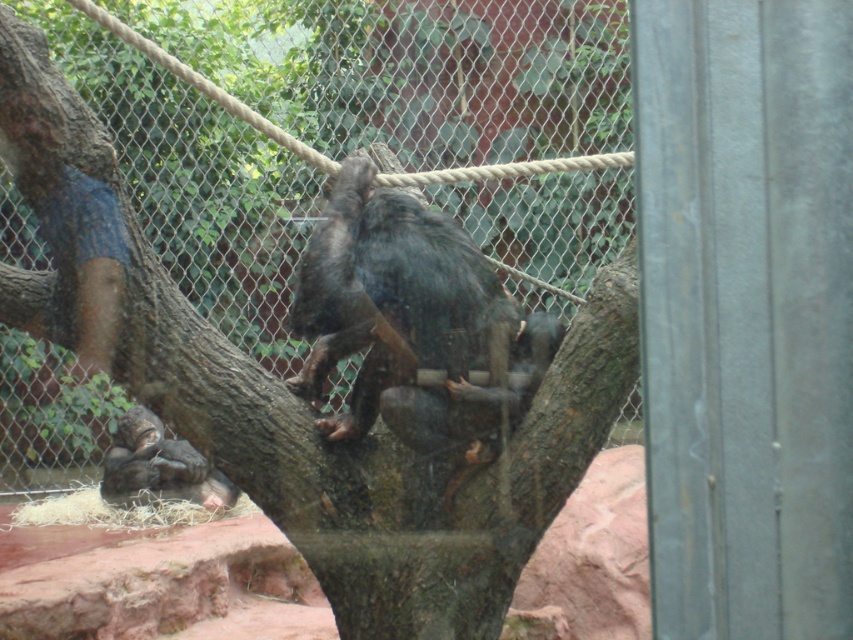
You are standing in front of a zoo enclosure observing the shiny black monkey at center. If you want to toss a banana to the monkey, which is 11.96 feet away, what is the minimum distance you need to move forward to ensure the banana reaches it?

The shiny black monkey at center is 11.96 feet away from you. To ensure the banana reaches it, you need to move forward so that the distance between you and the monkey is less than or equal to the banana toss range. However, without knowing the exact toss range, the minimum distance to move forward cannot be determined precisely. But if assuming the banana can be tossed up to 12 feet, you could stay at your current position since 11.96 feet is within that range. Otherwise, adjust accordingly.

You are a zookeeper observing the chimpanzees in their enclosure. You notice two monkeys, a shiny black monkey at center and a dark gray fur monkey at lower left. Which monkey is positioned to the east of the other?

The shiny black monkey at center is to the right of dark gray fur monkey at lower left. Since the enclosure is oriented with the chimpanzee facing north, the right side would correspond to the east direction. Therefore, the shiny black monkey at center is positioned to the east of the dark gray fur monkey at lower left.

You are a zookeeper trying to locate a specific point on the chimpanzee for a health check. The point is marked at coordinates point (412, 323). Based on the scene description, where would this point be located on the shiny black monkey at center?

The point (412, 323) is located on the shiny black monkey at center, specifically on its body.